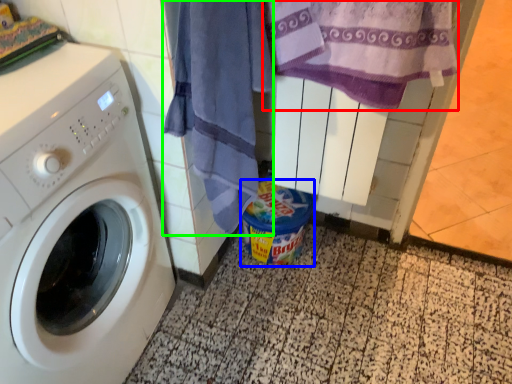
Question: Which is nearer to the beach towel (highlighted by a red box)? garbage (highlighted by a blue box) or beach towel (highlighted by a green box).

Choices:
 (A) garbage
 (B) beach towel

Answer: (B)